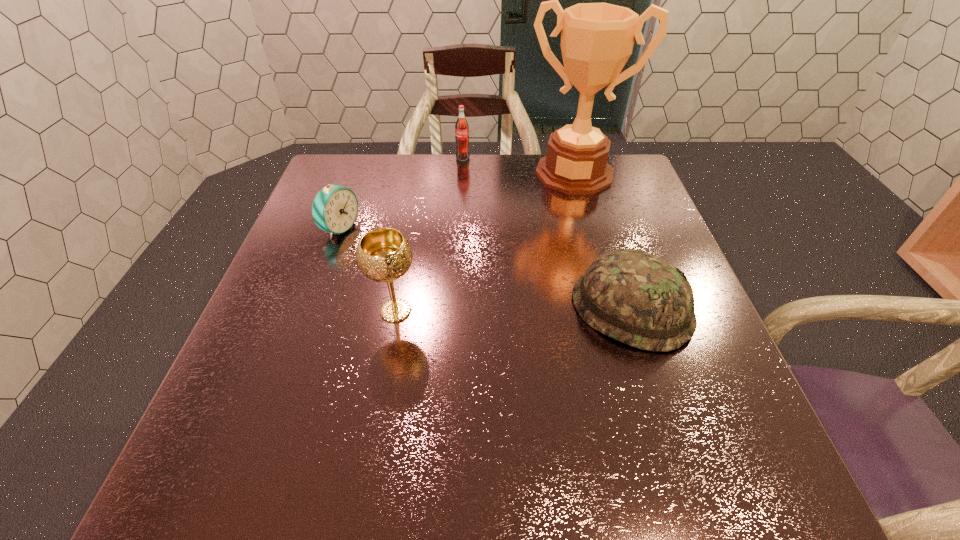
This screenshot has height=540, width=960. Find the location of `object located in the left edge section of the desktop`. object located in the left edge section of the desktop is located at coordinates (335, 207).

Where is `headwear that is at the right edge`? This screenshot has height=540, width=960. headwear that is at the right edge is located at coordinates 637,298.

I want to click on award positioned at the right edge, so click(x=597, y=39).

At what (x,y) coordinates should I click in order to perform the action: click on object that is at the far right corner. Please return your answer as a coordinate pair (x, y). This screenshot has height=540, width=960. Looking at the image, I should click on (597, 39).

You are a GUI agent. You are given a task and a screenshot of the screen. Output one action in this format:
    pyautogui.click(x=<x>, y=<y>)
    Task: Click on the blank space at the far edge
    Image resolution: width=960 pixels, height=540 pixels.
    Given the screenshot: What is the action you would take?
    pyautogui.click(x=492, y=168)

Where is `free region at the near edge of the desktop`? Image resolution: width=960 pixels, height=540 pixels. free region at the near edge of the desktop is located at coordinates (490, 426).

Find the location of a particular element. This screenshot has height=540, width=960. vacant region at the left edge of the desktop is located at coordinates (324, 270).

Find the location of a particular element. Image resolution: width=960 pixels, height=540 pixels. vacant space at the right edge is located at coordinates (724, 381).

Locate an element on the screen. The image size is (960, 540). free space at the far left corner of the desktop is located at coordinates (372, 171).

The height and width of the screenshot is (540, 960). I want to click on free point at the far right corner, so click(629, 190).